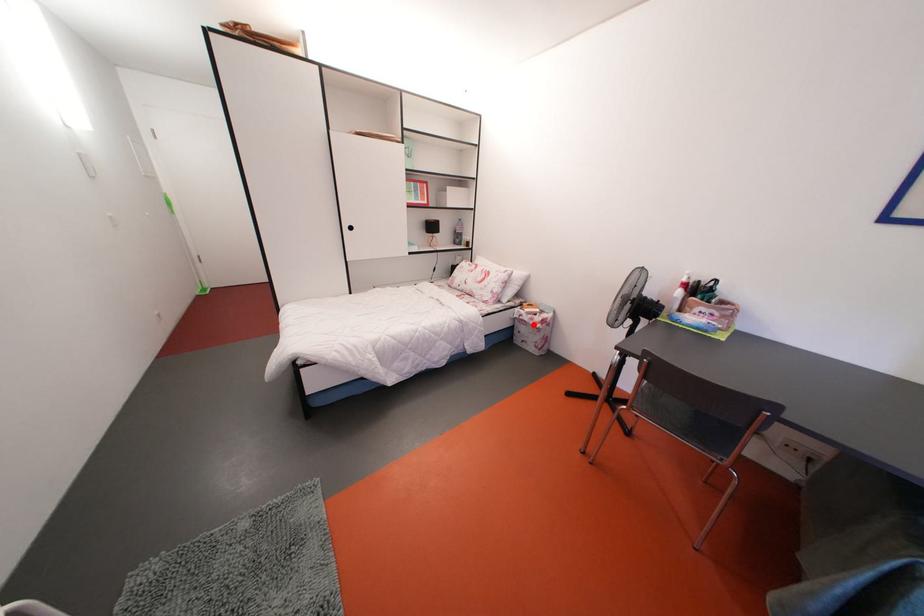
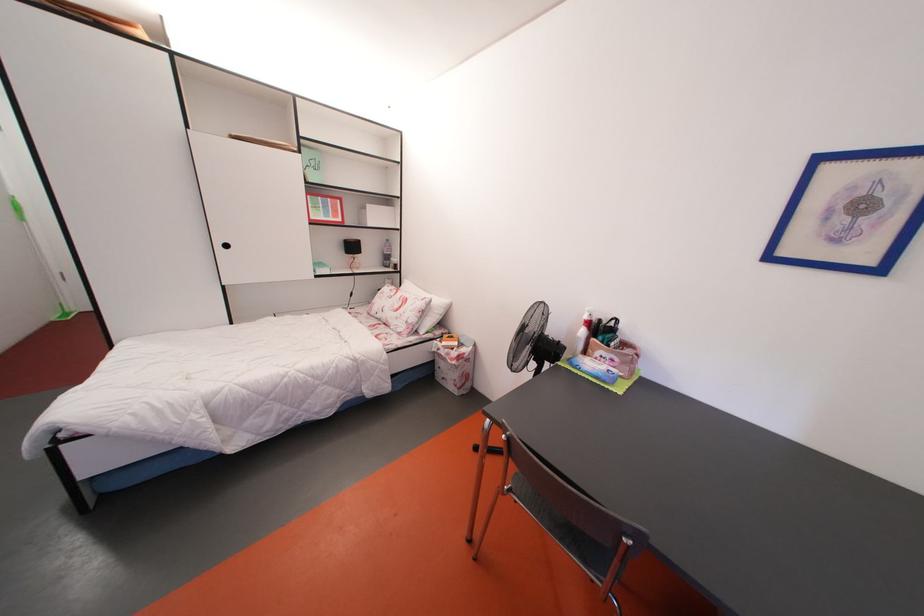
In the second image, find the point that corresponds to the highlighted location in the first image.

(450, 360)